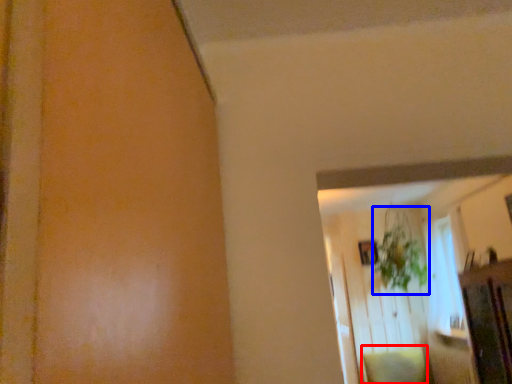
Question: Among these objects, which one is farthest to the camera, pillow (highlighted by a red box) or plant (highlighted by a blue box)?

Choices:
 (A) pillow
 (B) plant

Answer: (B)